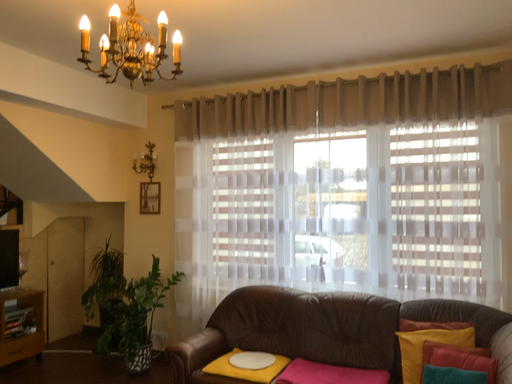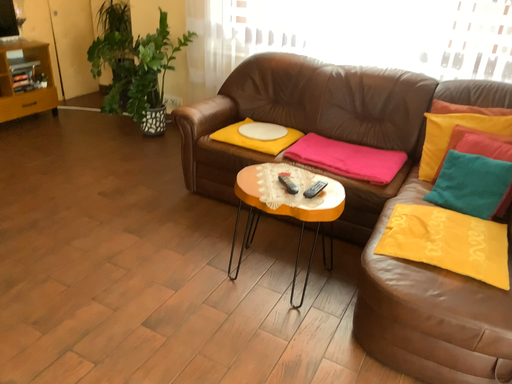
Question: How did the camera likely rotate when shooting the video?

Choices:
 (A) rotated upward
 (B) rotated downward

Answer: (B)